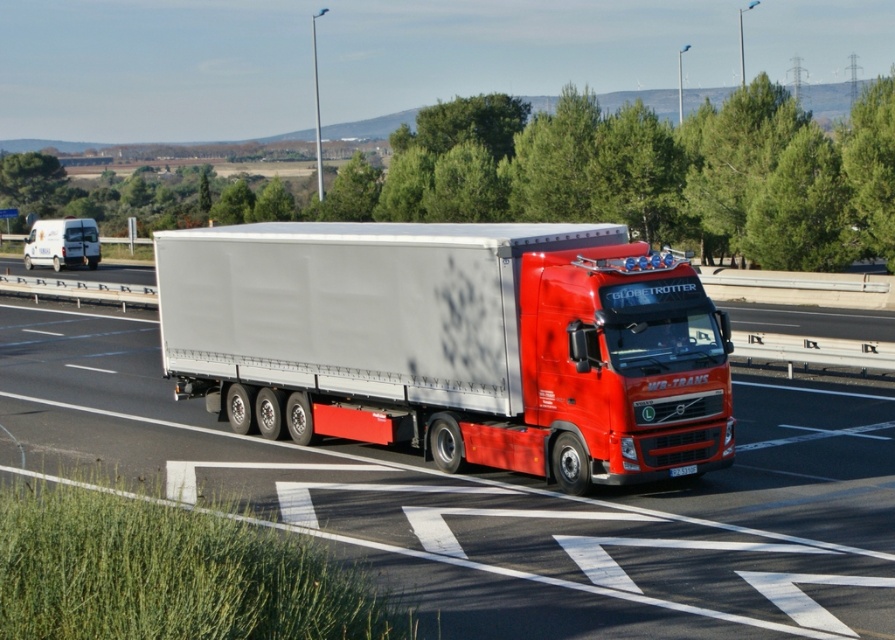
You are a driver who needs to pass through a narrow tunnel that has a maximum width limit of 2.8 meters. Based on the image, can you determine if the white matte trailer truck at center and the white matte van at left can both safely pass through the tunnel without exceeding the width limit?

The white matte trailer truck at center might be wider than white matte van at left, so it is uncertain if both can pass through the tunnel. The van might be within the limit, but the truck could exceed it. Check the truck width before proceeding.